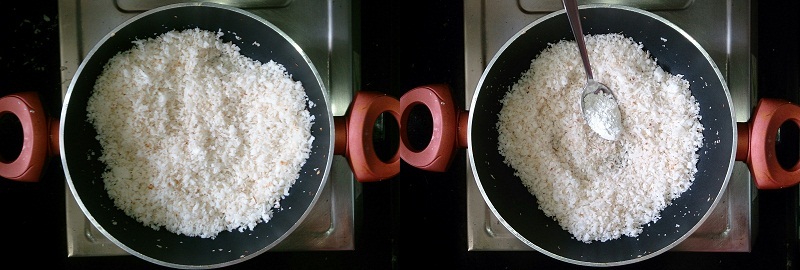
The image size is (800, 270). Find the location of `pot handle`. pot handle is located at coordinates (26, 141), (354, 120), (429, 95), (754, 144).